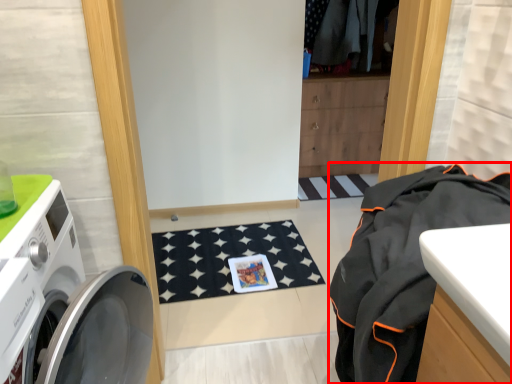
Question: Considering the relative positions of clothing (annotated by the red box) and washing machine in the image provided, where is clothing (annotated by the red box) located with respect to the staircase?

Choices:
 (A) right
 (B) left

Answer: (A)